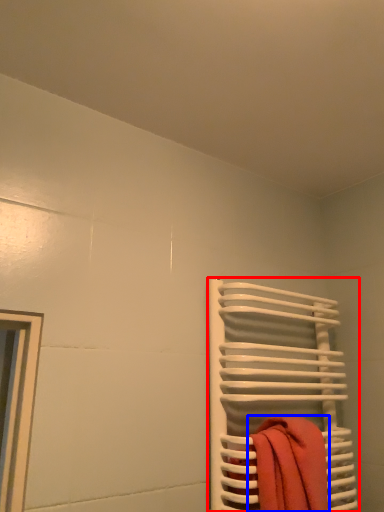
Question: Which of the following is the farthest to the observer, towel rack (highlighted by a red box) or beach towel (highlighted by a blue box)?

Choices:
 (A) towel rack
 (B) beach towel

Answer: (A)